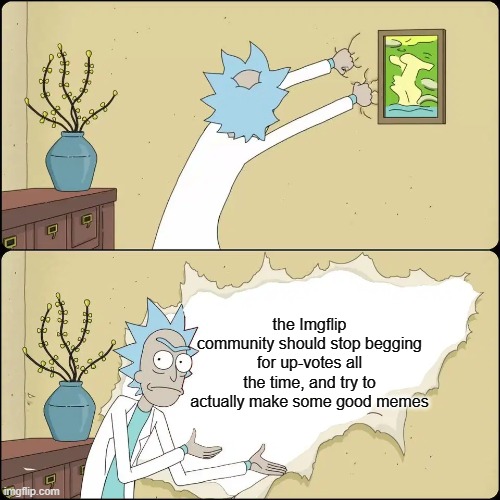
Find the location of a particular element. upper screen blue vase is located at coordinates (79, 159).